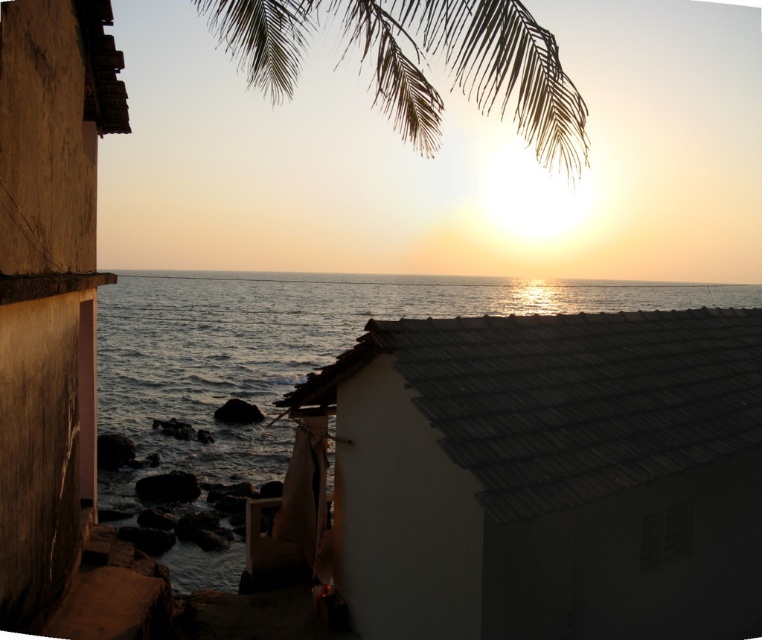
Measure the distance between point [628,307] and camera.

Point [628,307] and camera are 393.07 feet apart.

Is point (242, 276) positioned after point (363, 54)?

Yes, it is.

Between point (162, 285) and point (517, 1), which one is positioned in front?

Point (517, 1) is in front.

The height and width of the screenshot is (640, 762). In order to click on blue water at center in this screenshot , I will do `click(290, 348)`.

Can you confirm if smooth brown wall at left is positioned below blue water at center?

Yes.

Does smooth brown wall at left have a lesser height compared to blue water at center?

Correct, smooth brown wall at left is not as tall as blue water at center.

Between point (47, 449) and point (482, 314), which one is positioned behind?

The point (482, 314) is more distant.

Where is `smooth brown wall at left`? The image size is (762, 640). smooth brown wall at left is located at coordinates (50, 291).

Does smooth brown wall at left have a lesser height compared to silvery textured leaves at upper center?

Correct, smooth brown wall at left is not as tall as silvery textured leaves at upper center.

Is smooth brown wall at left in front of silvery textured leaves at upper center?

That is False.

Does point (87, 227) come in front of point (453, 84)?

Yes, it is in front of point (453, 84).

The width and height of the screenshot is (762, 640). In order to click on smooth brown wall at left in this screenshot , I will do `click(50, 291)`.